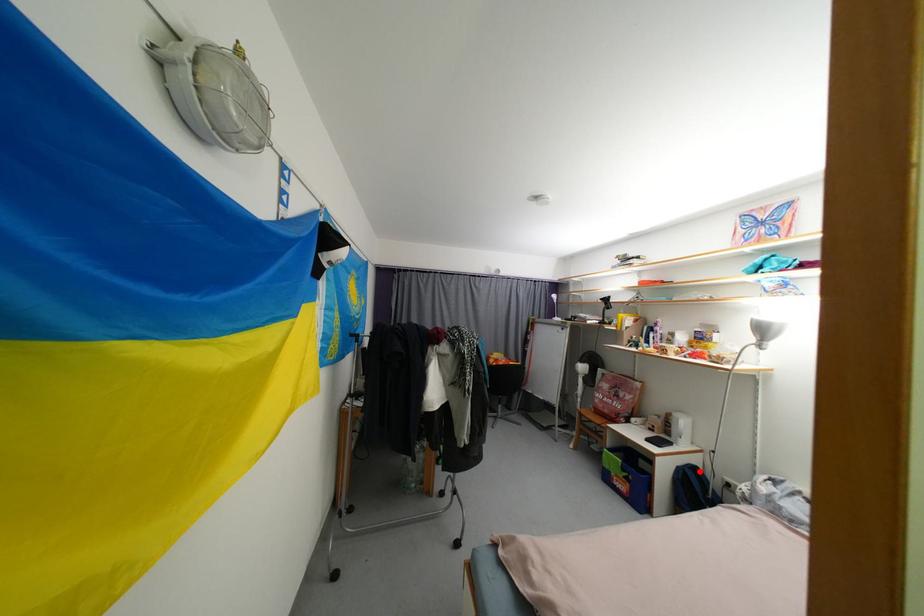
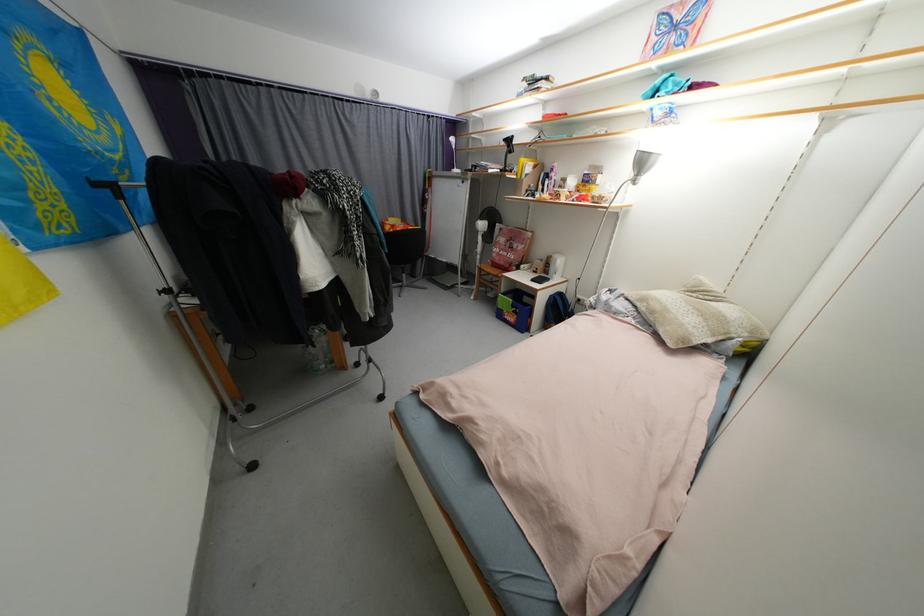
Question: I am providing you with two images of the same scene from different viewpoints. In image1, a red point is highlighted. Considering the same 3D point in image2, which of the following is correct?

Choices:
 (A) It is closer
 (B) It is farther

Answer: (B)